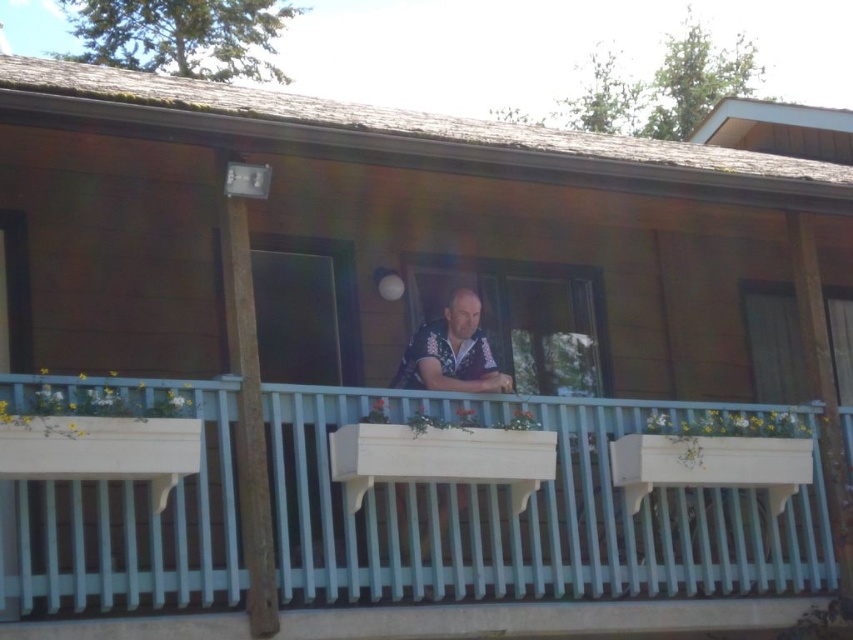
Between white painted wood porch at center and matte black window at center, which one has less height?

white painted wood porch at center

Is white painted wood porch at center positioned behind matte black window at center?

No.

You are a GUI agent. You are given a task and a screenshot of the screen. Output one action in this format:
    pyautogui.click(x=<x>, y=<y>)
    Task: Click on the white painted wood porch at center
    
    Given the screenshot: What is the action you would take?
    pyautogui.click(x=529, y=512)

Identify the location of white painted wood porch at center. (529, 512).